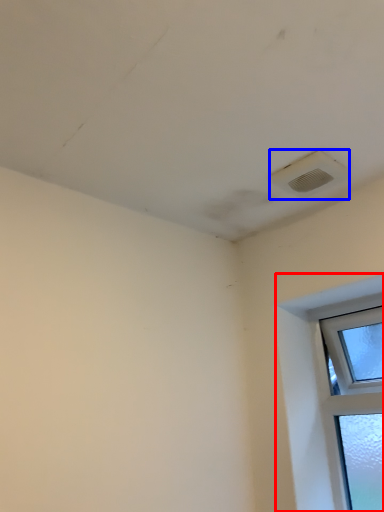
Question: Which object is closer to the camera taking this photo, window (highlighted by a red box) or air conditioning (highlighted by a blue box)?

Choices:
 (A) window
 (B) air conditioning

Answer: (B)